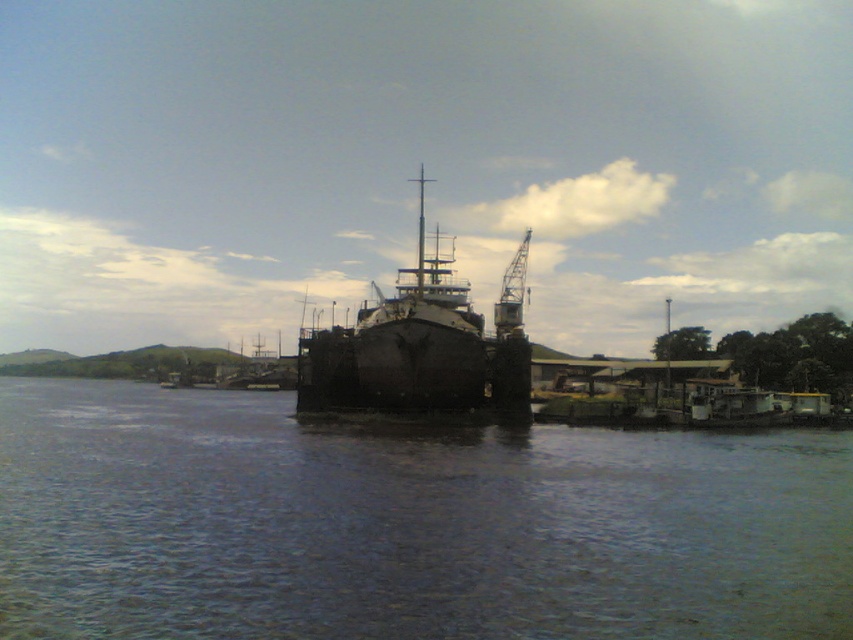
Question: Does dark blue water at center appear under rusty metal ship at center?

Choices:
 (A) no
 (B) yes

Answer: (B)

Question: Which point is closer to the camera?

Choices:
 (A) [379, 368]
 (B) [282, 592]

Answer: (B)

Question: Is dark blue water at center wider than rusty metal ship at center?

Choices:
 (A) yes
 (B) no

Answer: (A)

Question: Observing the image, what is the correct spatial positioning of dark blue water at center in reference to rusty metal ship at center?

Choices:
 (A) below
 (B) above

Answer: (A)

Question: Among these points, which one is nearest to the camera?

Choices:
 (A) (189, 406)
 (B) (514, 269)

Answer: (A)

Question: Which of the following is the farthest from the observer?

Choices:
 (A) rusty metal ship at center
 (B) dark blue water at center

Answer: (A)